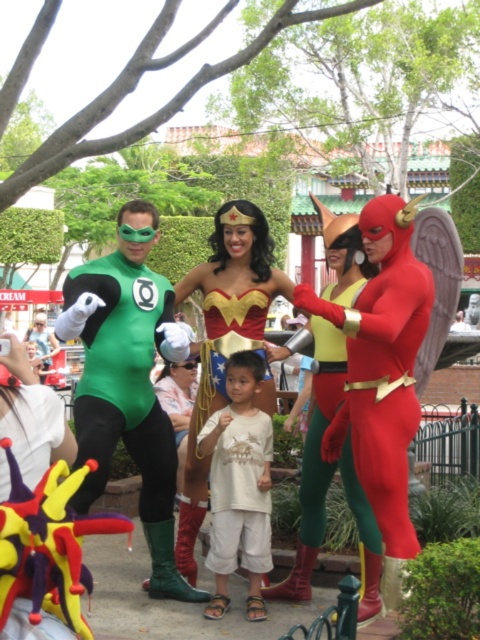
Question: Among these points, which one is nearest to the camera?

Choices:
 (A) (412, 227)
 (B) (311, 592)
 (C) (237, 364)

Answer: (A)

Question: Estimate the real-world distances between objects in this image. Which object is closer to the shiny gold tiara at center?

Choices:
 (A) shiny red suit at right
 (B) shiny red suit at center
 (C) shiny gold costume at center
 (D) shiny green costume at center

Answer: (B)

Question: Can you confirm if green spandex suit at left is positioned to the right of shiny gold tiara at center?

Choices:
 (A) yes
 (B) no

Answer: (B)

Question: Among these points, which one is farthest from the camera?

Choices:
 (A) (227, 598)
 (B) (322, 396)
 (C) (428, 298)

Answer: (B)

Question: Is shiny red suit at right wider than shiny gold costume at center?

Choices:
 (A) yes
 (B) no

Answer: (A)

Question: Considering the relative positions of shiny gold costume at center and white cotton shirt at center in the image provided, where is shiny gold costume at center located with respect to white cotton shirt at center?

Choices:
 (A) above
 (B) below

Answer: (A)